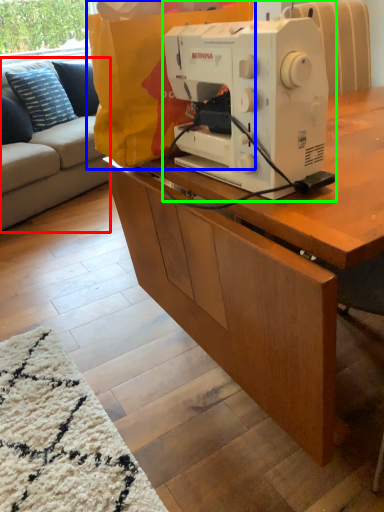
Question: Considering the real-world distances, which object is closest to studio couch (highlighted by a red box)? paper bag (highlighted by a blue box) or sewing machine (highlighted by a green box).

Choices:
 (A) paper bag
 (B) sewing machine

Answer: (A)